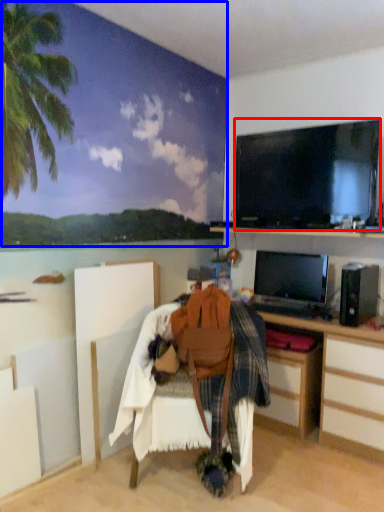
Question: Among these objects, which one is farthest to the camera, television (highlighted by a red box) or backdrop (highlighted by a blue box)?

Choices:
 (A) television
 (B) backdrop

Answer: (A)